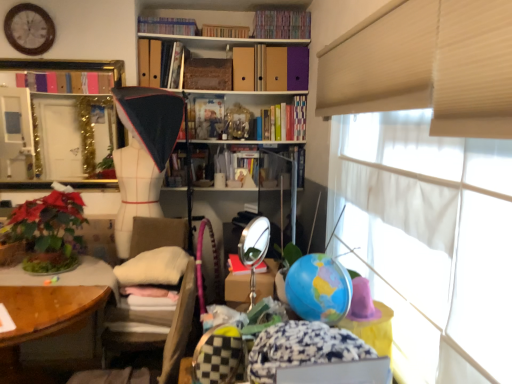
Question: In which direction should I rotate to look at hardcover books at upper center, marked as the 1th book in a top-to-bottom arrangement?

Choices:
 (A) right
 (B) left

Answer: (A)

Question: Does wooden at left have a greater height compared to white fabric mannequin at center?

Choices:
 (A) yes
 (B) no

Answer: (B)

Question: Is wooden at left positioned in front of white fabric mannequin at center?

Choices:
 (A) yes
 (B) no

Answer: (A)

Question: From a real-world perspective, is wooden at left below white fabric mannequin at center?

Choices:
 (A) no
 (B) yes

Answer: (B)

Question: Does wooden at left turn towards white fabric mannequin at center?

Choices:
 (A) no
 (B) yes

Answer: (A)

Question: Can you confirm if wooden at left is bigger than white fabric mannequin at center?

Choices:
 (A) yes
 (B) no

Answer: (A)

Question: Can you confirm if wooden at left is smaller than white fabric mannequin at center?

Choices:
 (A) yes
 (B) no

Answer: (B)

Question: From a real-world perspective, is wooden clock at upper left positioned over beige fabric chair at center based on gravity?

Choices:
 (A) yes
 (B) no

Answer: (A)

Question: Is the position of wooden clock at upper left less distant than that of beige fabric chair at center?

Choices:
 (A) yes
 (B) no

Answer: (B)

Question: Can you confirm if wooden clock at upper left is wider than beige fabric chair at center?

Choices:
 (A) no
 (B) yes

Answer: (A)

Question: Considering the relative positions of wooden clock at upper left and beige fabric chair at center in the image provided, is wooden clock at upper left to the left of beige fabric chair at center from the viewer's perspective?

Choices:
 (A) yes
 (B) no

Answer: (A)

Question: Are wooden clock at upper left and beige fabric chair at center far apart?

Choices:
 (A) yes
 (B) no

Answer: (A)

Question: Is wooden clock at upper left turned away from beige fabric chair at center?

Choices:
 (A) no
 (B) yes

Answer: (A)

Question: From a real-world perspective, is matte plastic book at center, which appears as the second book when ordered from the bottom, over gold metallic mirror at upper left?

Choices:
 (A) yes
 (B) no

Answer: (A)